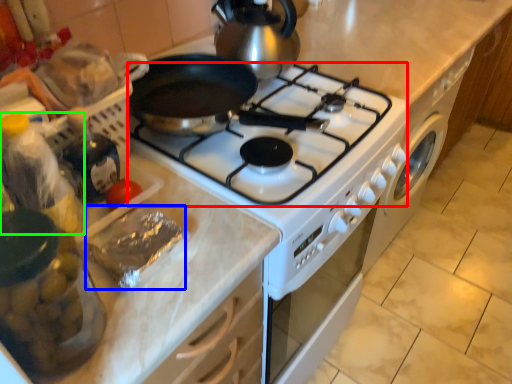
Question: Based on their relative distances, which object is nearer to gas stove (highlighted by a red box)? Choose from food (highlighted by a blue box) and bottle (highlighted by a green box).

Choices:
 (A) food
 (B) bottle

Answer: (A)